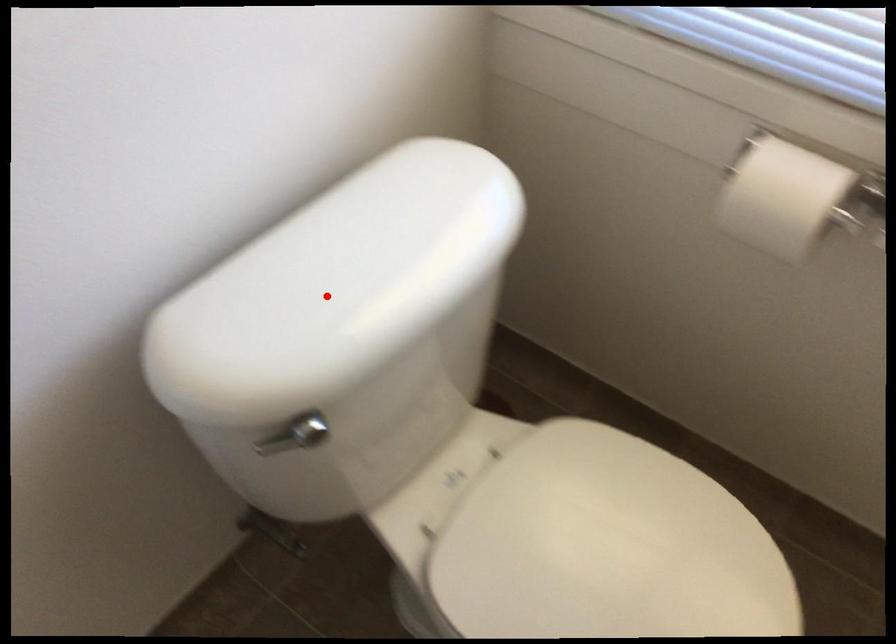
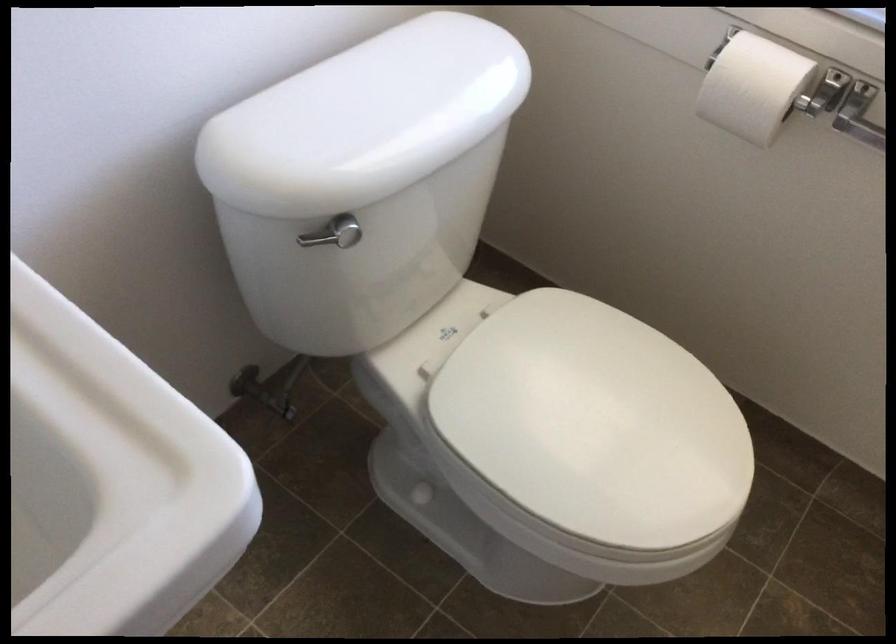
Question: I am providing you with two images of the same scene from different viewpoints. A red point is shown in image1. For the corresponding object point in image2, is it positioned nearer or farther from the camera?

Choices:
 (A) Nearer
 (B) Farther

Answer: (B)